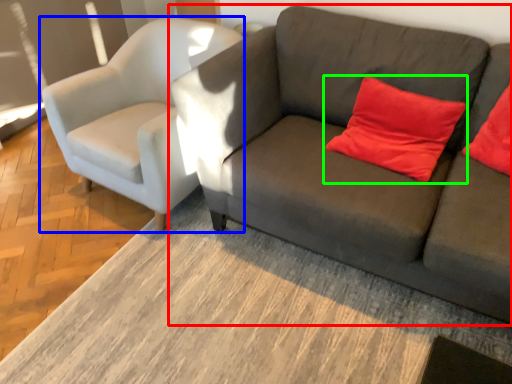
Question: Which object is the closest to the studio couch (highlighted by a red box)? Choose among these: chair (highlighted by a blue box) or pillow (highlighted by a green box).

Choices:
 (A) chair
 (B) pillow

Answer: (B)